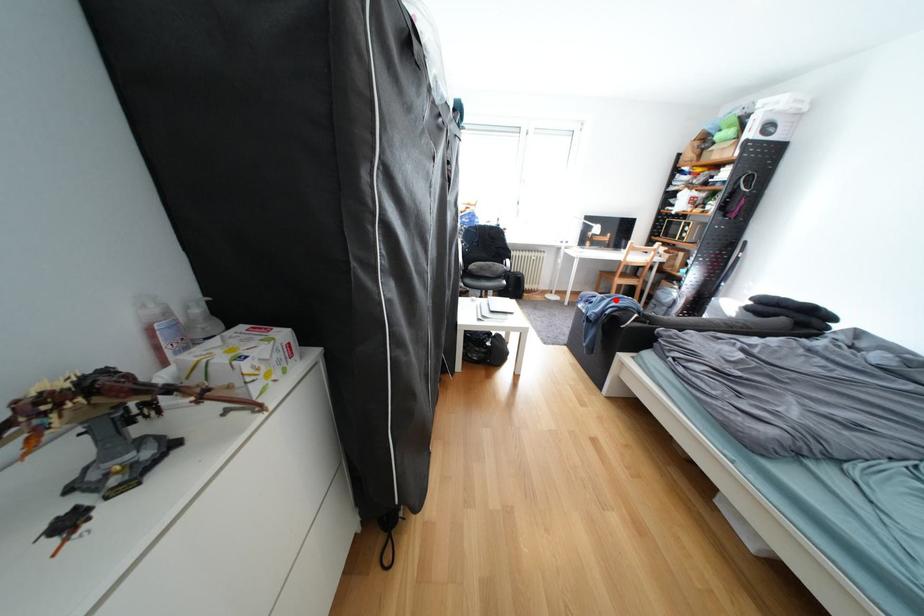
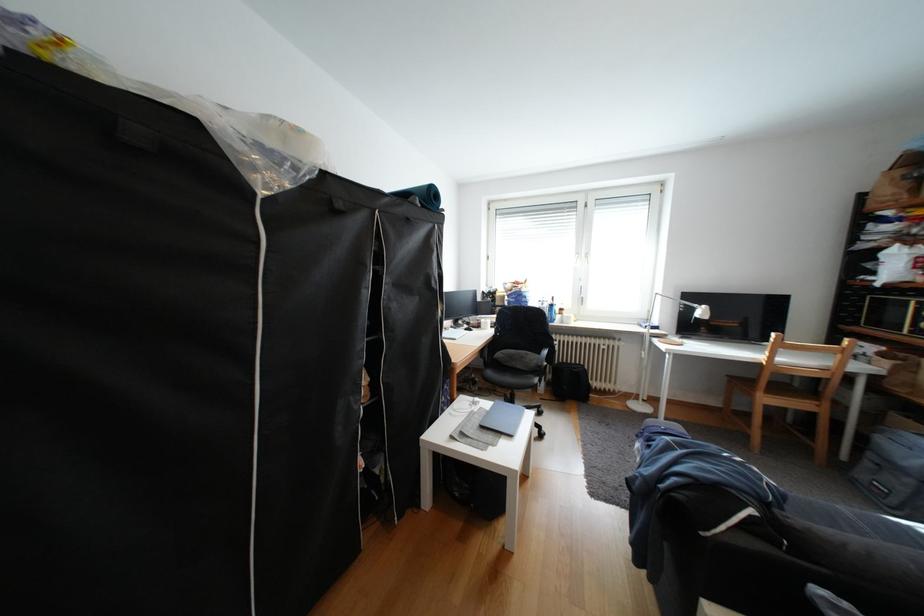
Question: I am providing you with two images of the same scene from different viewpoints. A red point is shown in image1. For the corresponding object point in image2, is it positioned nearer or farther from the camera?

Choices:
 (A) Nearer
 (B) Farther

Answer: (B)